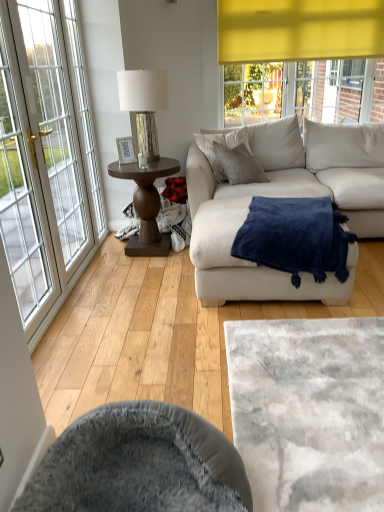
Locate an element on the screen. This screenshot has width=384, height=512. vacant area that lies between velvet grey swivel chair at lower center and velvety gray cat bed at lower center is located at coordinates (181, 373).